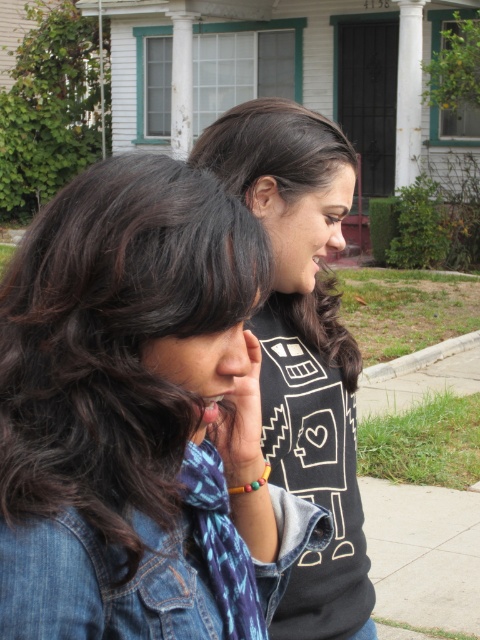
Question: Does black matte shirt at center appear on the right side of matte black hand at center?

Choices:
 (A) yes
 (B) no

Answer: (A)

Question: Which point is closer to the camera?

Choices:
 (A) matte black hand at center
 (B) black matte sweatshirt at center
 (C) black matte shirt at center

Answer: (A)

Question: Is black matte shirt at center above matte black hand at center?

Choices:
 (A) no
 (B) yes

Answer: (B)

Question: Based on their relative distances, which object is farther from the matte black hand at center?

Choices:
 (A) denim jacket at lower right
 (B) black matte sweatshirt at center
 (C) denim jacket at center

Answer: (B)

Question: Among these points, which one is nearest to the camera?

Choices:
 (A) (261, 419)
 (B) (154, 602)
 (C) (339, 323)
 (D) (230, 147)

Answer: (B)

Question: Does black matte sweatshirt at center lie behind matte black hand at center?

Choices:
 (A) yes
 (B) no

Answer: (A)